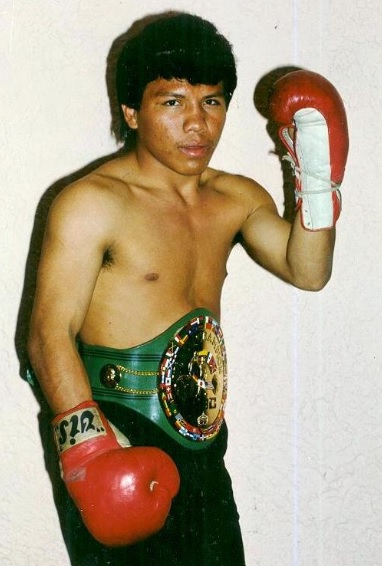
Identify the location of white wall. (355, 493).